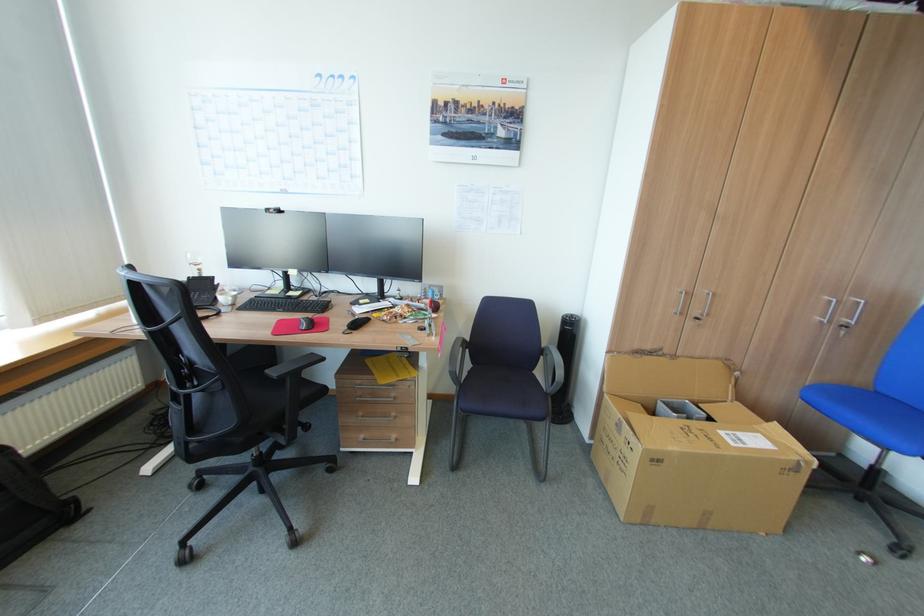
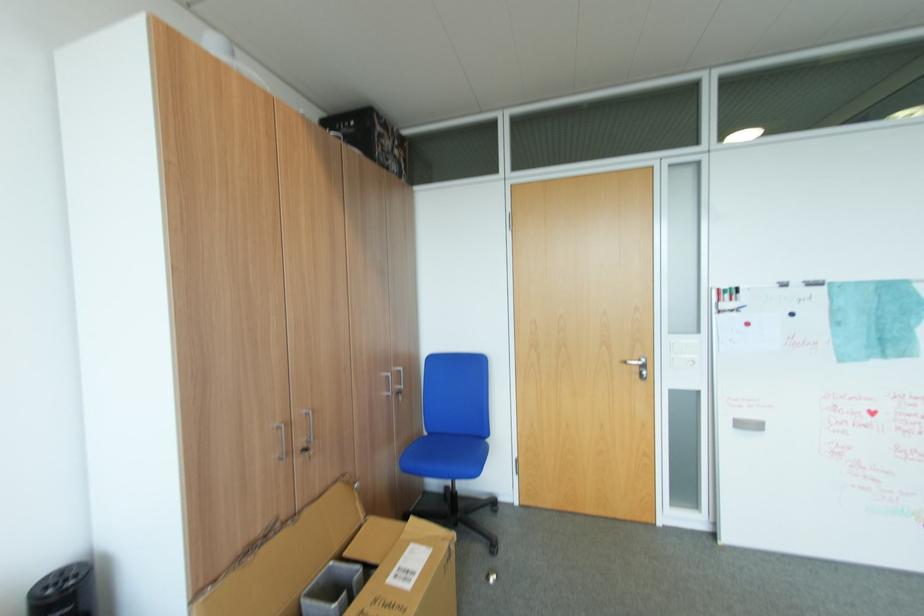
Find the pixel in the second image that matches (x=670, y=403) in the first image.

(317, 593)